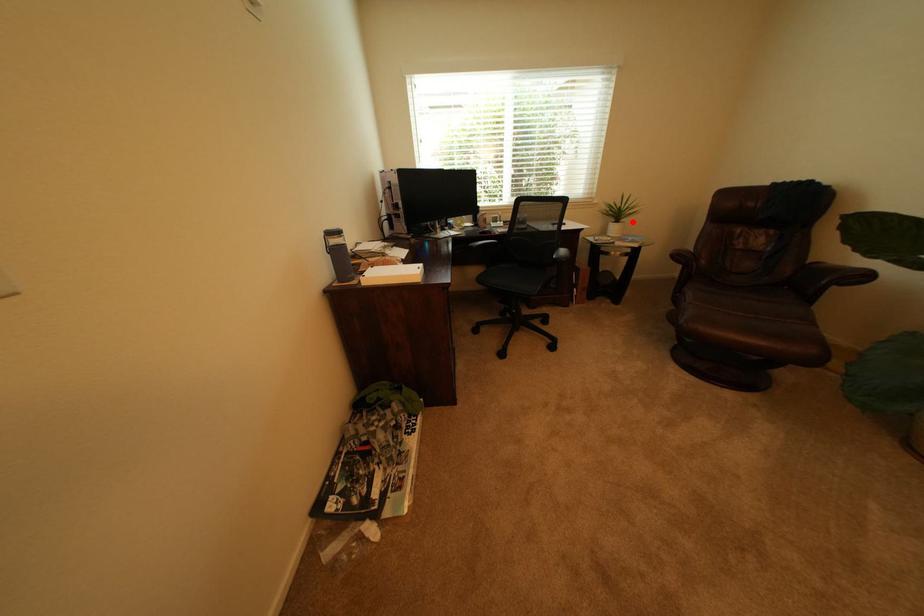
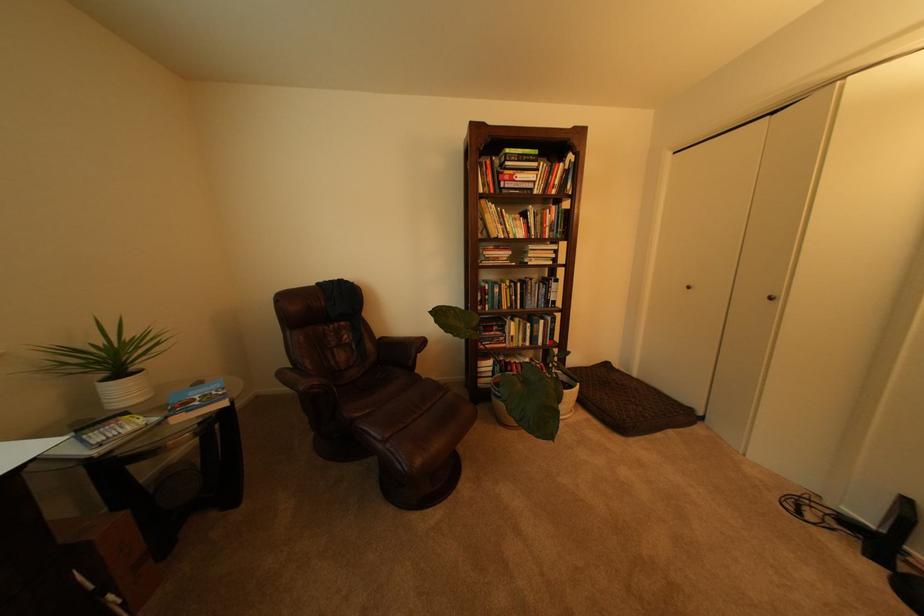
Question: I am providing you with two images of the same scene from different viewpoints. A red point is shown in image1. For the corresponding object point in image2, is it positioned nearer or farther from the camera?

Choices:
 (A) Nearer
 (B) Farther

Answer: (B)